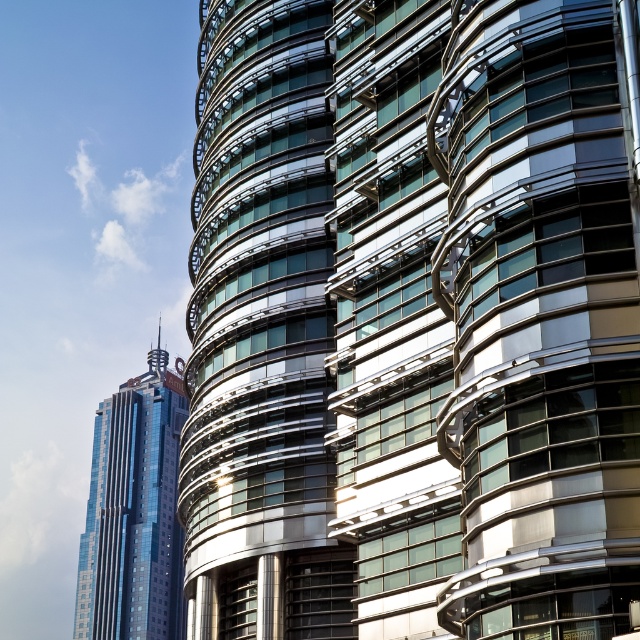
You are an architect analyzing the urban skyline. You notice the glassy metallic skyscraper at center and the shiny blue glass skyscraper at left. Which of these two buildings has a narrower width?

The glassy metallic skyscraper at center is thinner than the shiny blue glass skyscraper at left, so it has a narrower width.

You are an architect evaluating the urban skyline. You need to determine which of the two skyscrapers, the glassy metallic skyscraper at center or the shiny blue glass skyscraper at left, is the shorter one. Based on the scene, which one is shorter?

The glassy metallic skyscraper at center is smaller in size compared to the shiny blue glass skyscraper at left, so it is the shorter one.

You are standing in front of the modern architectural scene and want to locate the point at coordinates (412, 323). Which building does this point belong to?

The point at coordinates (412, 323) is on the glassy metallic skyscraper at center.